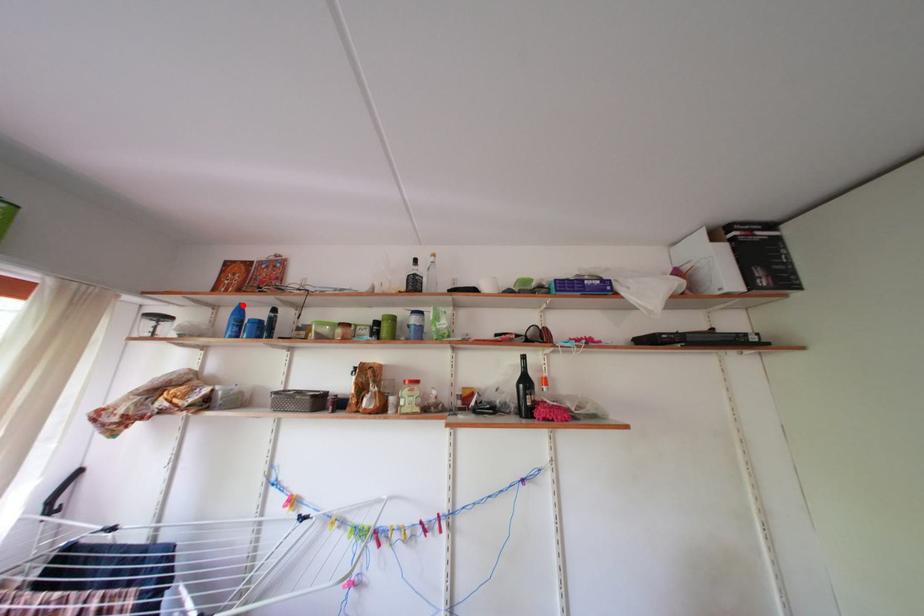
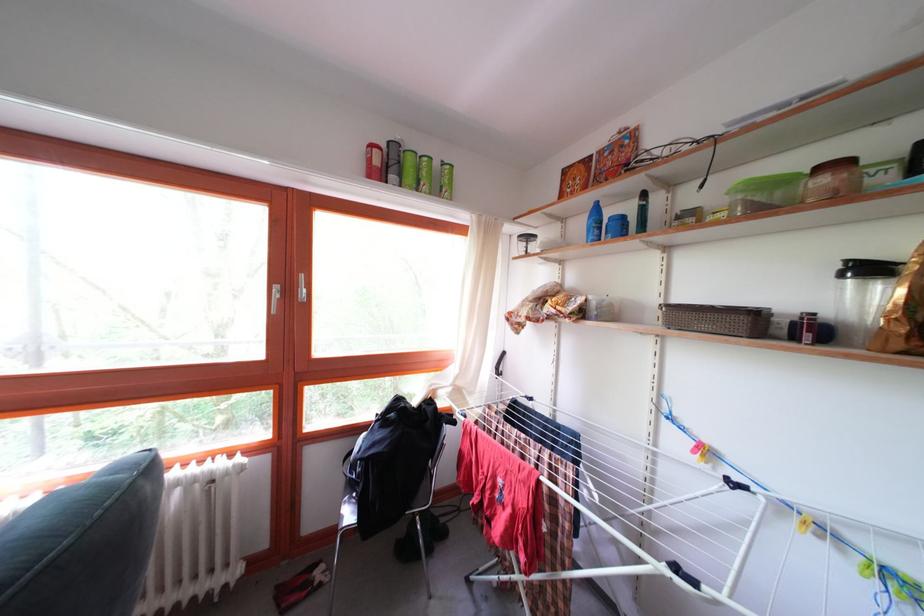
In the second image, find the point that corresponds to the highlighted location in the first image.

(598, 204)